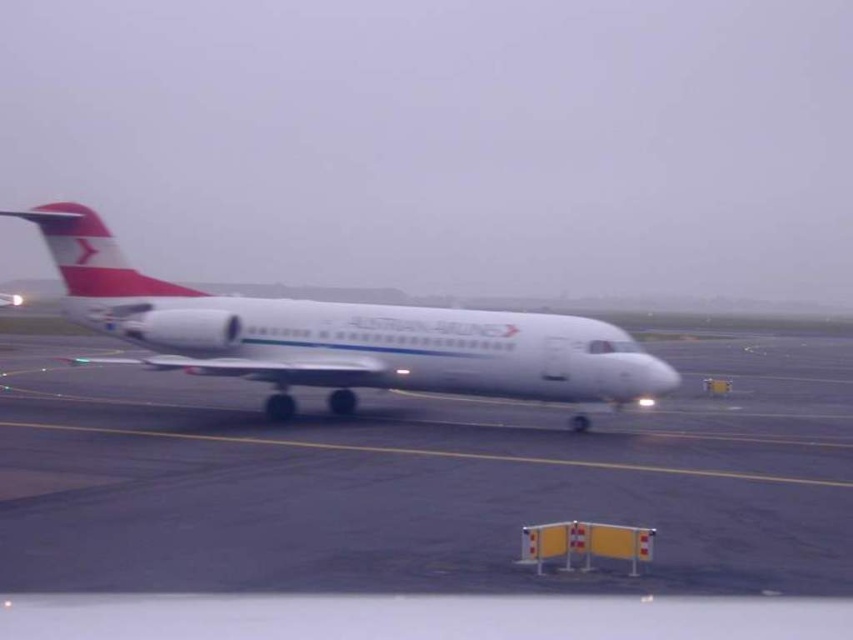
Does point (84, 496) lie behind point (625, 376)?

No, it is not.

Can you confirm if white smooth tarmac at center is thinner than white matte airplane at center?

No.

Which is behind, point (695, 512) or point (514, 324)?

Positioned behind is point (514, 324).

The image size is (853, 640). Identify the location of white smooth tarmac at center. (421, 483).